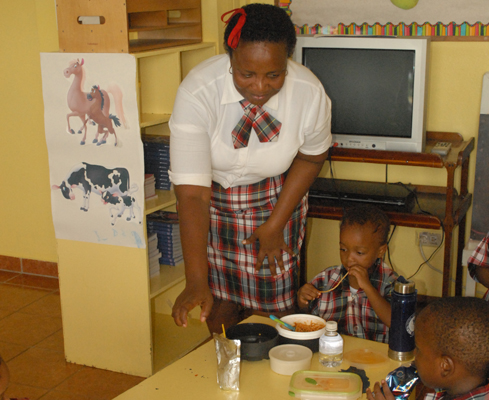
Image resolution: width=489 pixels, height=400 pixels. Identify the location of thermos. (400, 313).